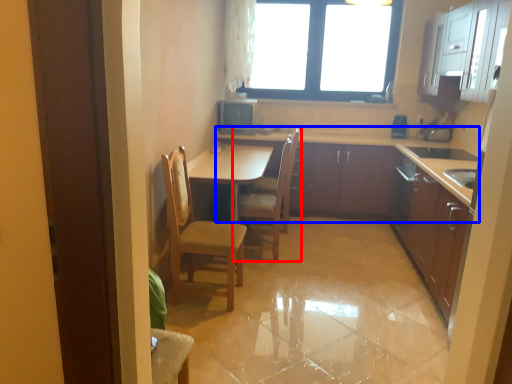
Question: Which object is further to the camera taking this photo, chair (highlighted by a red box) or cabinetry (highlighted by a blue box)?

Choices:
 (A) chair
 (B) cabinetry

Answer: (B)